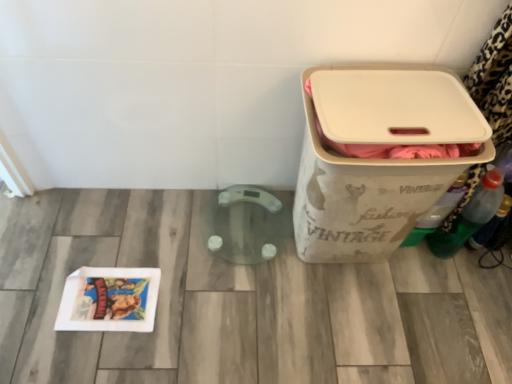
The image size is (512, 384). Identify the location of vacant space that is to the left of green plastic bottle at right, the 2th bottle viewed from the left. (407, 264).